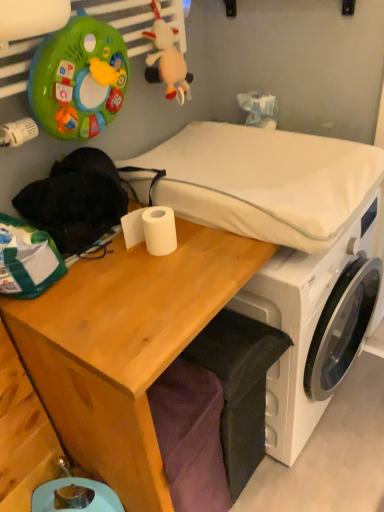
Question: Could you tell me if white matte toilet paper at center is facing white plastic washing machine at center?

Choices:
 (A) no
 (B) yes

Answer: (A)

Question: Is the position of white matte toilet paper at center more distant than that of white plastic washing machine at center?

Choices:
 (A) no
 (B) yes

Answer: (A)

Question: Does white matte toilet paper at center contain white plastic washing machine at center?

Choices:
 (A) yes
 (B) no

Answer: (B)

Question: Does white matte toilet paper at center have a greater height compared to white plastic washing machine at center?

Choices:
 (A) yes
 (B) no

Answer: (B)

Question: From a real-world perspective, is white matte toilet paper at center beneath white plastic washing machine at center?

Choices:
 (A) no
 (B) yes

Answer: (A)

Question: Is white fabric mattress at center wider or thinner than white matte toilet paper at center?

Choices:
 (A) wide
 (B) thin

Answer: (A)

Question: Considering their positions, is white fabric mattress at center located in front of or behind white matte toilet paper at center?

Choices:
 (A) front
 (B) behind

Answer: (A)

Question: Is point (311, 194) closer or farther from the camera than point (120, 220)?

Choices:
 (A) farther
 (B) closer

Answer: (B)

Question: In terms of size, does white fabric mattress at center appear bigger or smaller than white matte toilet paper at center?

Choices:
 (A) big
 (B) small

Answer: (A)

Question: Considering their positions, is white plastic washing machine at center located in front of or behind white fabric mattress at center?

Choices:
 (A) behind
 (B) front

Answer: (A)

Question: Based on their positions, is white plastic washing machine at center located to the left or right of white fabric mattress at center?

Choices:
 (A) left
 (B) right

Answer: (B)

Question: From a real-world perspective, is white plastic washing machine at center positioned above or below white fabric mattress at center?

Choices:
 (A) below
 (B) above

Answer: (A)

Question: From the image's perspective, is white plastic washing machine at center located above or below white fabric mattress at center?

Choices:
 (A) above
 (B) below

Answer: (B)

Question: In terms of size, does wooden desk at center appear bigger or smaller than white plastic washing machine at center?

Choices:
 (A) big
 (B) small

Answer: (A)

Question: From the image's perspective, is wooden desk at center above or below white plastic washing machine at center?

Choices:
 (A) below
 (B) above

Answer: (A)